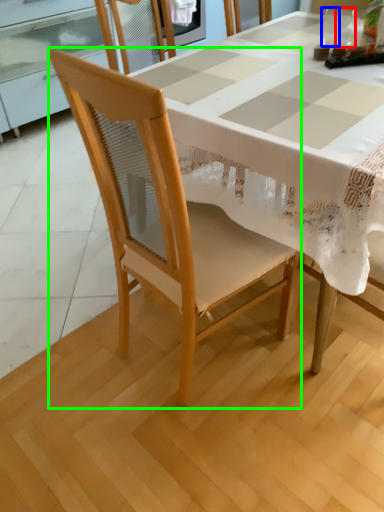
Question: Which object is the closest to the tableware (highlighted by a red box)? Choose among these: tableware (highlighted by a blue box) or chair (highlighted by a green box).

Choices:
 (A) tableware
 (B) chair

Answer: (A)